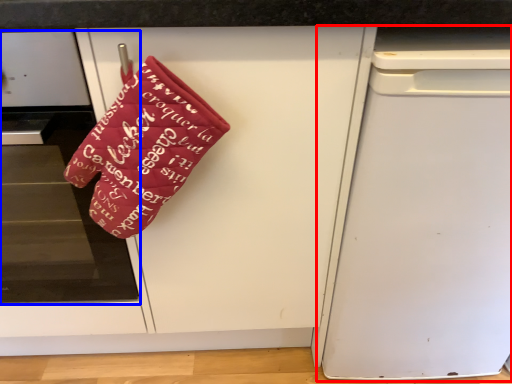
Question: Which of the following is the farthest to the observer, dish washer (highlighted by a red box) or home appliance (highlighted by a blue box)?

Choices:
 (A) dish washer
 (B) home appliance

Answer: (A)